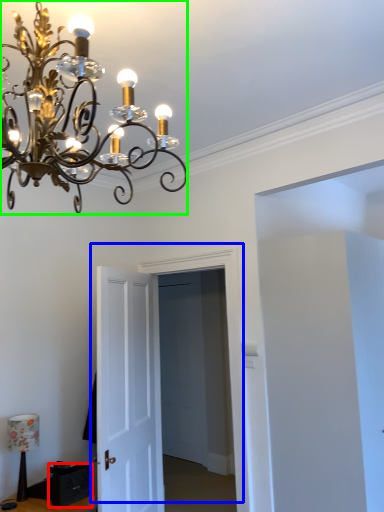
Question: Which is nearer to the drawer (highlighted by a red box)? door (highlighted by a blue box) or lamp (highlighted by a green box).

Choices:
 (A) door
 (B) lamp

Answer: (A)